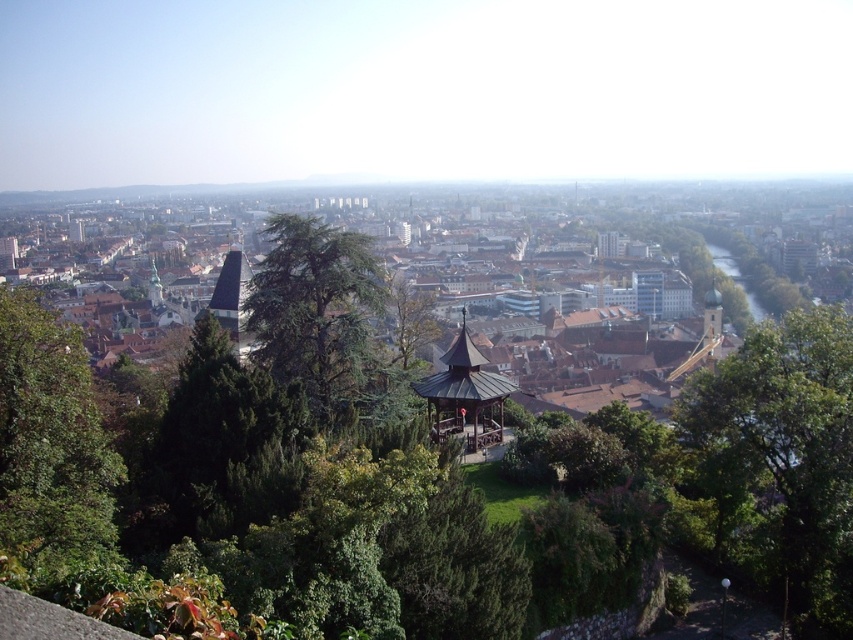
Which is more to the right, brown wooden gazebo at center or wooden gazebo at center?

Positioned to the right is wooden gazebo at center.

Can you confirm if brown wooden gazebo at center is thinner than wooden gazebo at center?

Incorrect, brown wooden gazebo at center's width is not less than wooden gazebo at center's.

The width and height of the screenshot is (853, 640). Describe the element at coordinates (592, 330) in the screenshot. I see `brown wooden gazebo at center` at that location.

This screenshot has width=853, height=640. I want to click on brown wooden gazebo at center, so click(x=592, y=330).

Can you confirm if brown wooden gazebo at center is smaller than green leafy tree at right?

Incorrect, brown wooden gazebo at center is not smaller in size than green leafy tree at right.

From the picture: Which is more to the left, brown wooden gazebo at center or green leafy tree at right?

From the viewer's perspective, brown wooden gazebo at center appears more on the left side.

Measure the distance between point (346, 234) and camera.

Point (346, 234) is 84.22 meters from camera.

Identify the location of brown wooden gazebo at center. The height and width of the screenshot is (640, 853). (592, 330).

From the picture: Can you confirm if green leafy tree at right is thinner than green leafy tree at left?

In fact, green leafy tree at right might be wider than green leafy tree at left.

Is point (701, 388) farther from camera compared to point (32, 474)?

Yes.

Is point (834, 512) closer to viewer compared to point (35, 323)?

No.

Identify the location of green leafy tree at right. pos(781,461).